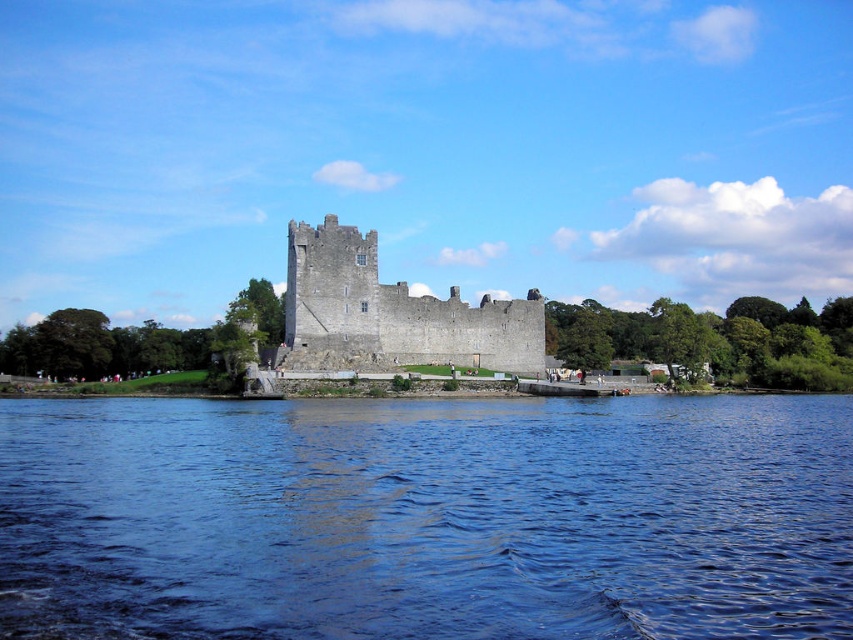
Looking at this image, can you confirm if blue water at lower center is shorter than gray stone castle at center?

Yes, blue water at lower center is shorter than gray stone castle at center.

Is blue water at lower center further to the viewer compared to gray stone castle at center?

No, blue water at lower center is closer to the viewer.

Does point (372, 426) come behind point (397, 353)?

No, it is in front of (397, 353).

Where is `blue water at lower center`? blue water at lower center is located at coordinates (426, 516).